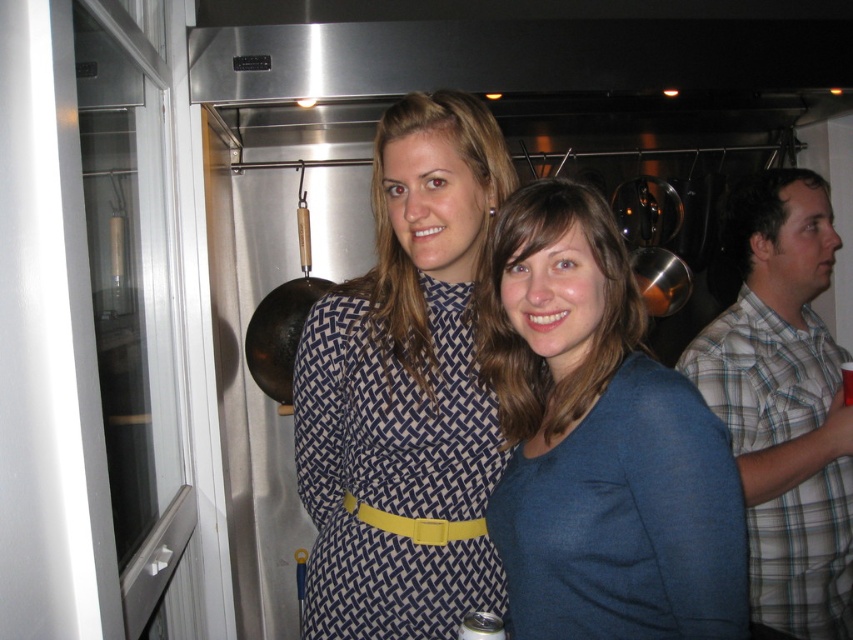
Question: Is the position of blue woven fabric dress at center more distant than that of plaid shirt at right?

Choices:
 (A) no
 (B) yes

Answer: (A)

Question: Among these points, which one is farthest from the camera?

Choices:
 (A) (814, 269)
 (B) (579, 310)

Answer: (A)

Question: Can you confirm if blue woven fabric dress at center is positioned above blue woven dress at center?

Choices:
 (A) yes
 (B) no

Answer: (B)

Question: Where is plaid shirt at right located in relation to blue woven dress at center in the image?

Choices:
 (A) left
 (B) right

Answer: (B)

Question: Which point is closer to the camera?

Choices:
 (A) click(648, 588)
 (B) click(839, 416)

Answer: (A)

Question: Among these objects, which one is nearest to the camera?

Choices:
 (A) plaid shirt at right
 (B) blue cotton shirt at center
 (C) blue woven fabric dress at center

Answer: (B)